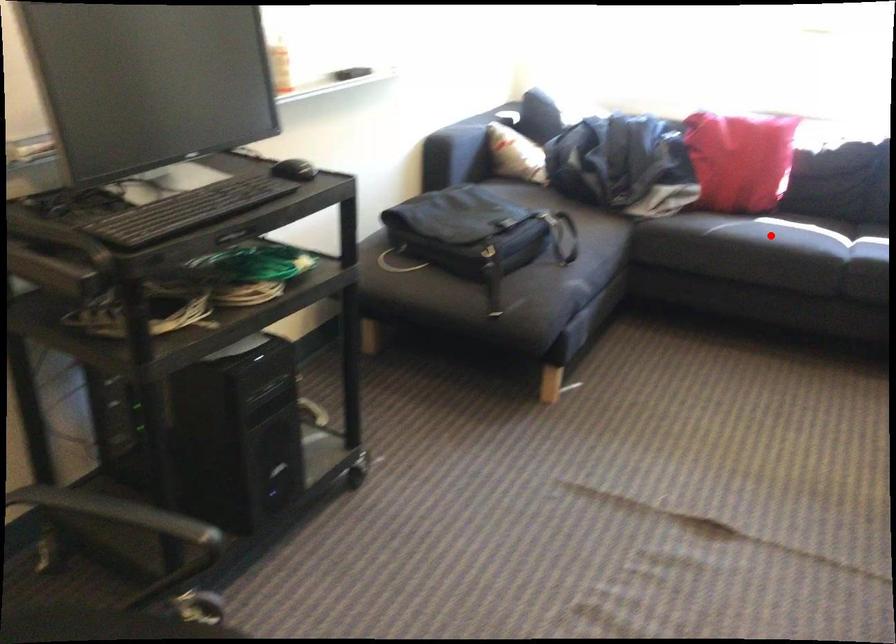
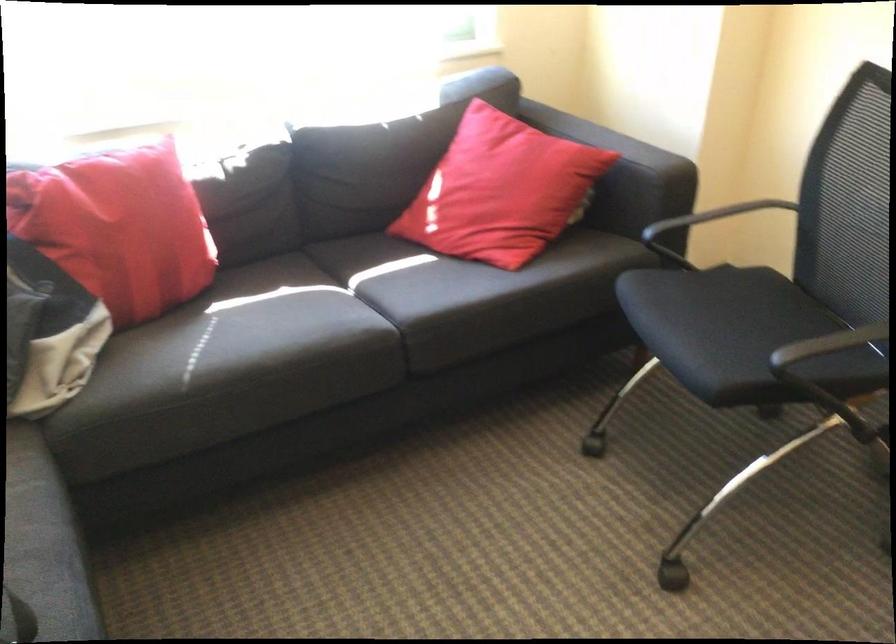
Locate, in the second image, the point that corresponds to the highlighted location in the first image.

(280, 346)